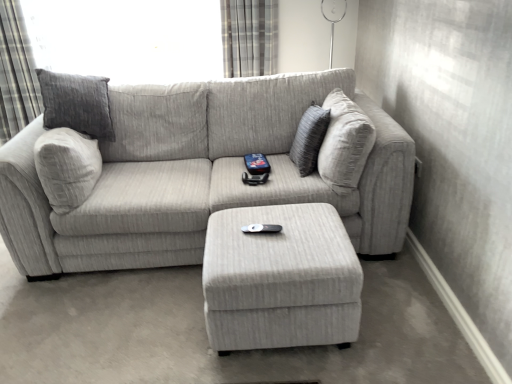
Question: Is gray textured curtain at upper left, which is the 1th curtain in left-to-right order, oriented towards plaid fabric curtain at upper center, arranged as the first curtain when viewed from the right?

Choices:
 (A) yes
 (B) no

Answer: (B)

Question: From a real-world perspective, is gray textured curtain at upper left, which is the 1th curtain in left-to-right order, located beneath plaid fabric curtain at upper center, arranged as the first curtain when viewed from the right?

Choices:
 (A) no
 (B) yes

Answer: (B)

Question: From a real-world perspective, is gray textured curtain at upper left, the 2th curtain positioned from the right, over plaid fabric curtain at upper center, arranged as the first curtain when viewed from the right?

Choices:
 (A) yes
 (B) no

Answer: (B)

Question: Is gray textured curtain at upper left, which is the 1th curtain in left-to-right order, with plaid fabric curtain at upper center, placed as the 2th curtain when sorted from left to right?

Choices:
 (A) no
 (B) yes

Answer: (A)

Question: Considering the relative positions of gray textured curtain at upper left, which is the 1th curtain in left-to-right order, and plaid fabric curtain at upper center, placed as the 2th curtain when sorted from left to right, in the image provided, is gray textured curtain at upper left, which is the 1th curtain in left-to-right order, to the left of plaid fabric curtain at upper center, placed as the 2th curtain when sorted from left to right, from the viewer's perspective?

Choices:
 (A) no
 (B) yes

Answer: (B)

Question: Looking at the image, does gray textured curtain at upper left, which is the 1th curtain in left-to-right order, seem bigger or smaller compared to textured gray couch at center?

Choices:
 (A) small
 (B) big

Answer: (A)

Question: Would you say gray textured curtain at upper left, which is the 1th curtain in left-to-right order, is to the left or to the right of textured gray couch at center in the picture?

Choices:
 (A) left
 (B) right

Answer: (A)

Question: In the image, is gray textured curtain at upper left, the 2th curtain positioned from the right, positioned in front of or behind textured gray couch at center?

Choices:
 (A) behind
 (B) front

Answer: (A)

Question: Is gray textured curtain at upper left, which is the 1th curtain in left-to-right order, inside or outside of textured gray couch at center?

Choices:
 (A) outside
 (B) inside

Answer: (A)

Question: In terms of height, does light gray fabric ottoman at center look taller or shorter compared to textured gray couch at center?

Choices:
 (A) short
 (B) tall

Answer: (A)

Question: Considering the relative positions of light gray fabric ottoman at center and textured gray couch at center in the image provided, is light gray fabric ottoman at center to the left or to the right of textured gray couch at center?

Choices:
 (A) left
 (B) right

Answer: (B)

Question: From a real-world perspective, is light gray fabric ottoman at center above or below textured gray couch at center?

Choices:
 (A) above
 (B) below

Answer: (B)

Question: Considering the positions of light gray fabric ottoman at center and textured gray couch at center in the image, is light gray fabric ottoman at center bigger or smaller than textured gray couch at center?

Choices:
 (A) small
 (B) big

Answer: (A)

Question: Based on their sizes in the image, would you say textured gray pillow at center is bigger or smaller than gray textured curtain at upper left, the 2th curtain positioned from the right?

Choices:
 (A) small
 (B) big

Answer: (A)

Question: Is textured gray pillow at center situated inside gray textured curtain at upper left, which is the 1th curtain in left-to-right order, or outside?

Choices:
 (A) outside
 (B) inside

Answer: (A)